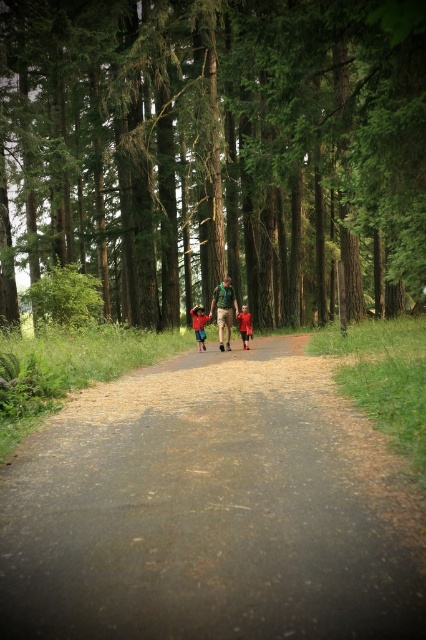
In the scene shown: You are a hiker who wants to take a photo of the green fabric shirt at center and the green textured tree at center together in the frame. Given that your camera has a maximum focus range of 12 meters, will both objects be in focus at the same time?

The green textured tree at center is 14.09 meters away from the green fabric shirt at center. Since the camera can only focus up to 12 meters, the distance between them exceeds the maximum focus range. Therefore, both objects cannot be in focus simultaneously.

From the picture: You are a hiker who just entered the forest and see the green fabric shirt at center and the red fabric shirt at center ahead on the path. Which one should you approach first to ask for directions?

You should approach the green fabric shirt at center first because it is closer to you than the red fabric shirt at center.